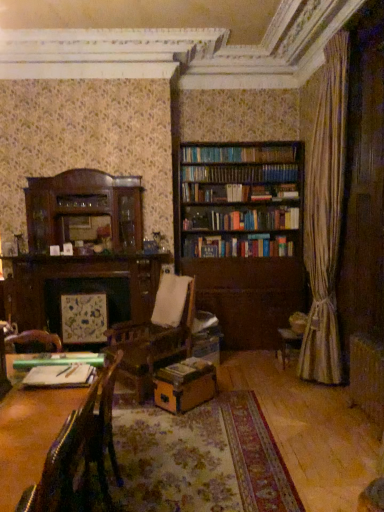
Question: Is green matte ruler at lower left, the first book from the front, in front of or behind leather cushioned chair at lower left, which ranks as the first chair in front-to-back order, in the image?

Choices:
 (A) behind
 (B) front

Answer: (A)

Question: From the image's perspective, relative to leather cushioned chair at lower left, the second chair in the back-to-front sequence, is green matte ruler at lower left, which is the second book in right-to-left order, above or below?

Choices:
 (A) above
 (B) below

Answer: (A)

Question: Which object is the farthest from the brown wooden bookcase at center?

Choices:
 (A) wooden book at center, which is the first book in bottom-to-top order
 (B) green matte ruler at lower left, which is the second book in bottom-to-top order
 (C) leather cushioned chair at lower left, which ranks as the first chair in front-to-back order
 (D) leather-like dark brown chair at lower left, the first chair positioned from the back
 (E) brown cardboard box at center

Answer: (C)

Question: Based on their relative distances, which object is nearer to the brown wooden bookcase at center?

Choices:
 (A) leather cushioned chair at lower left, the second chair in the back-to-front sequence
 (B) brown cardboard box at center
 (C) leather-like dark brown chair at lower left, which is the 2th chair from front to back
 (D) wooden book at center, which is the second book from left to right
 (E) green matte ruler at lower left, positioned as the first book in top-to-bottom order

Answer: (B)